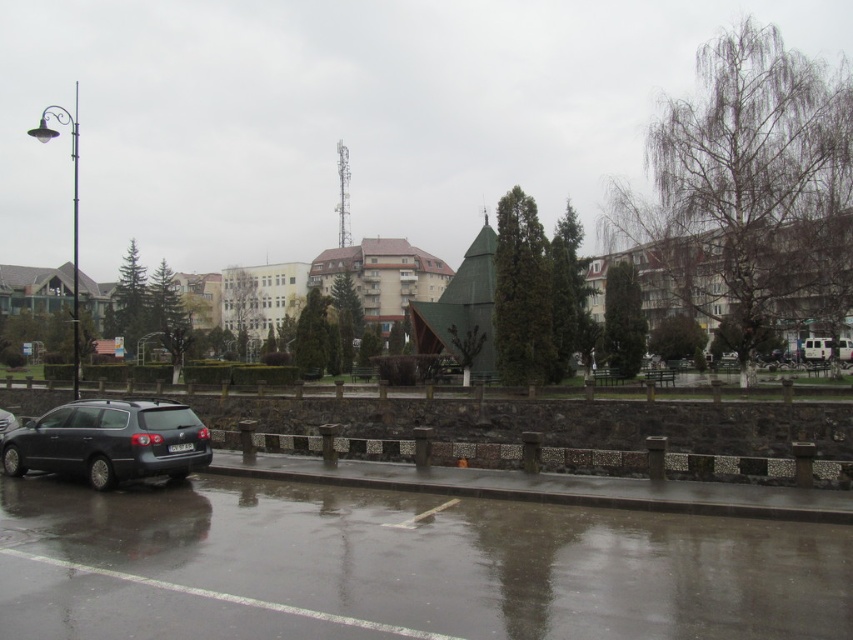
Can you confirm if metallic silver suv at lower right is bigger than satin black sedan at left?

Actually, metallic silver suv at lower right might be smaller than satin black sedan at left.

Who is more forward, (840, 339) or (0, 426)?

Point (0, 426) is more forward.

Identify the location of metallic silver suv at lower right. (827, 349).

This screenshot has width=853, height=640. What do you see at coordinates (109, 442) in the screenshot?
I see `satin black station wagon at lower left` at bounding box center [109, 442].

Which is behind, point (164, 424) or point (828, 349)?

The point (828, 349) is more distant.

Where is `satin black station wagon at lower left`? The height and width of the screenshot is (640, 853). satin black station wagon at lower left is located at coordinates (109, 442).

Which is more to the right, satin black station wagon at lower left or satin black sedan at left?

satin black station wagon at lower left

How far apart are satin black station wagon at lower left and satin black sedan at left?

satin black station wagon at lower left is 9.12 feet away from satin black sedan at left.

Which is in front, point (45, 433) or point (4, 435)?

Point (45, 433) is in front.

At what (x,y) coordinates should I click in order to perform the action: click on satin black station wagon at lower left. Please return your answer as a coordinate pair (x, y). Looking at the image, I should click on (109, 442).